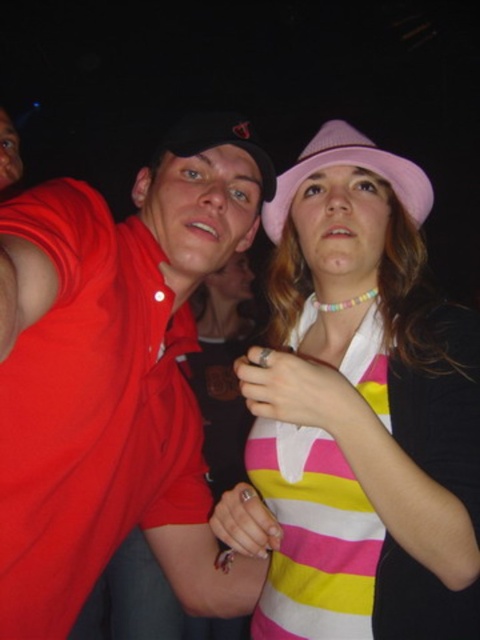
Question: Considering the real-world distances, which object is closest to the pink fabric baseball hat at upper center?

Choices:
 (A) pink fabric hat at upper center
 (B) matte red polo shirt at left

Answer: (A)

Question: Does pink fabric hat at upper center have a greater width compared to matte red polo shirt at left?

Choices:
 (A) yes
 (B) no

Answer: (B)

Question: Can you confirm if pink fabric hat at upper center is positioned below matte red polo shirt at left?

Choices:
 (A) no
 (B) yes

Answer: (A)

Question: Which point is farther to the camera?

Choices:
 (A) pink fabric hat at upper center
 (B) matte red polo shirt at left

Answer: (A)

Question: Is matte red polo shirt at left further to camera compared to pink fabric baseball hat at upper center?

Choices:
 (A) yes
 (B) no

Answer: (B)

Question: Which point is farther from the camera taking this photo?

Choices:
 (A) (286, 595)
 (B) (159, 552)
 (C) (421, 220)

Answer: (B)